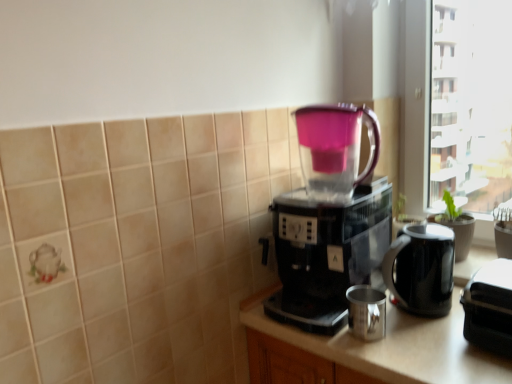
You are a GUI agent. You are given a task and a screenshot of the screen. Output one action in this format:
    pyautogui.click(x=<x>, y=<y>)
    Task: Click on the vacant space to the left of metallic silver mug at lower center
    
    Given the screenshot: What is the action you would take?
    pyautogui.click(x=310, y=336)